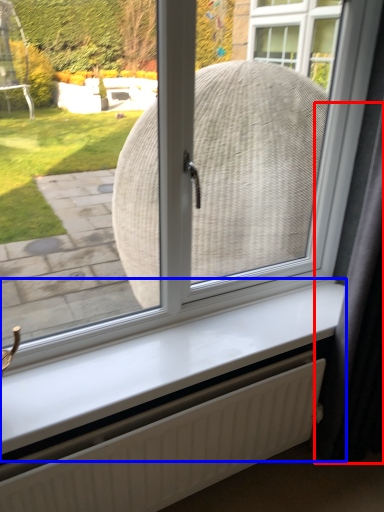
Question: Which object appears farthest to the camera in this image, curtain (highlighted by a red box) or window sill (highlighted by a blue box)?

Choices:
 (A) curtain
 (B) window sill

Answer: (B)